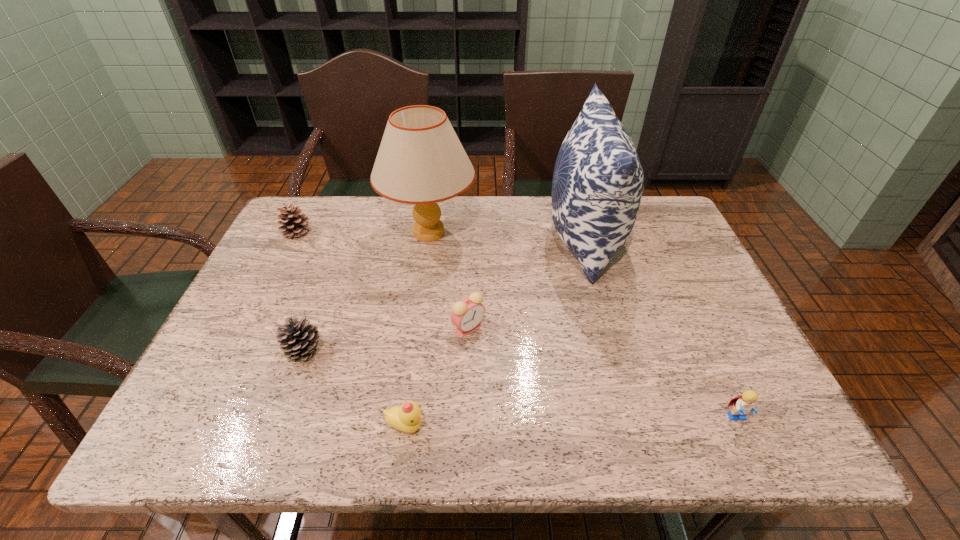
Where is `the second object from right to left`? The height and width of the screenshot is (540, 960). the second object from right to left is located at coordinates (597, 186).

The width and height of the screenshot is (960, 540). In order to click on lampshade in this screenshot , I will do `click(421, 161)`.

Find the location of a particular element. This screenshot has width=960, height=540. the leftmost object is located at coordinates (294, 222).

Where is `the left pinecone`? the left pinecone is located at coordinates (294, 222).

At what (x,y) coordinates should I click in order to perform the action: click on alarm clock. Please return your answer as a coordinate pair (x, y). Looking at the image, I should click on (467, 314).

Identify the location of the nearer pinecone. (298, 339).

This screenshot has width=960, height=540. Find the location of `the right pinecone`. the right pinecone is located at coordinates [x=298, y=339].

You are a GUI agent. You are given a task and a screenshot of the screen. Output one action in this format:
    pyautogui.click(x=<x>, y=<y>)
    Task: Click on the duckling
    
    Given the screenshot: What is the action you would take?
    pyautogui.click(x=407, y=418)

Locate an element on the screen. Image resolution: width=960 pixels, height=540 pixels. the rightmost object is located at coordinates (743, 404).

Find the location of a particular element. The height and width of the screenshot is (540, 960). vacant space located 0.280m on the front surface of the cushion is located at coordinates (450, 239).